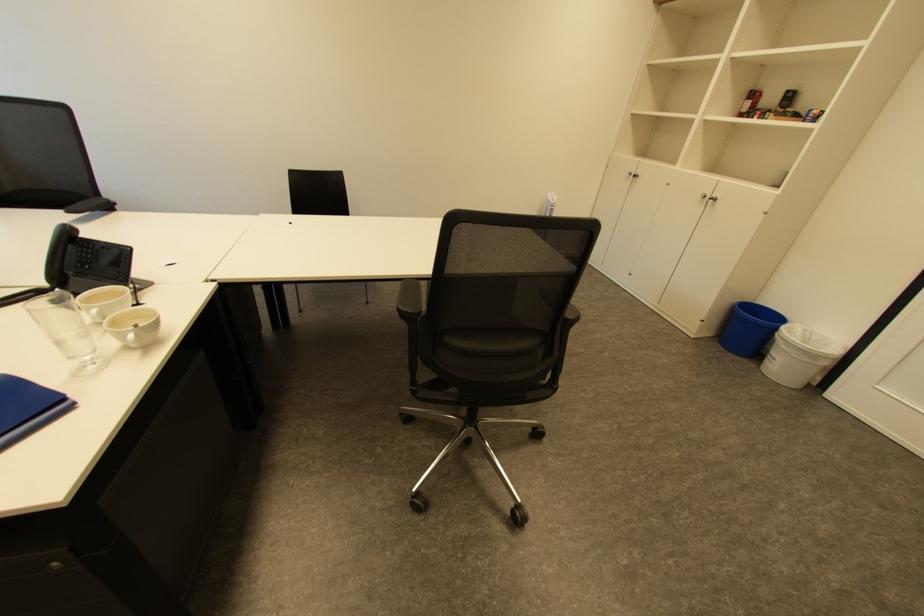
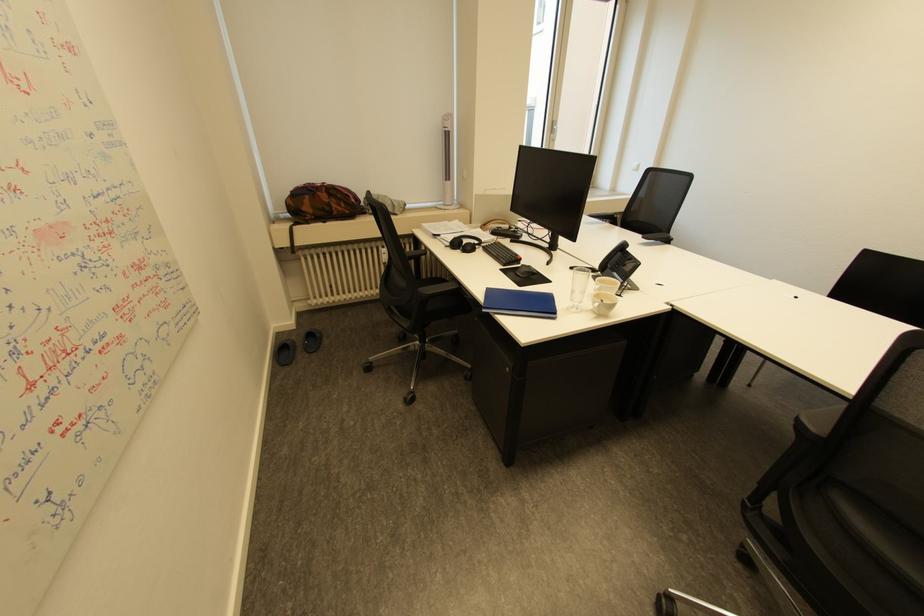
Find the pixel in the second image that matches the point at 93,301 in the first image.

(608, 281)